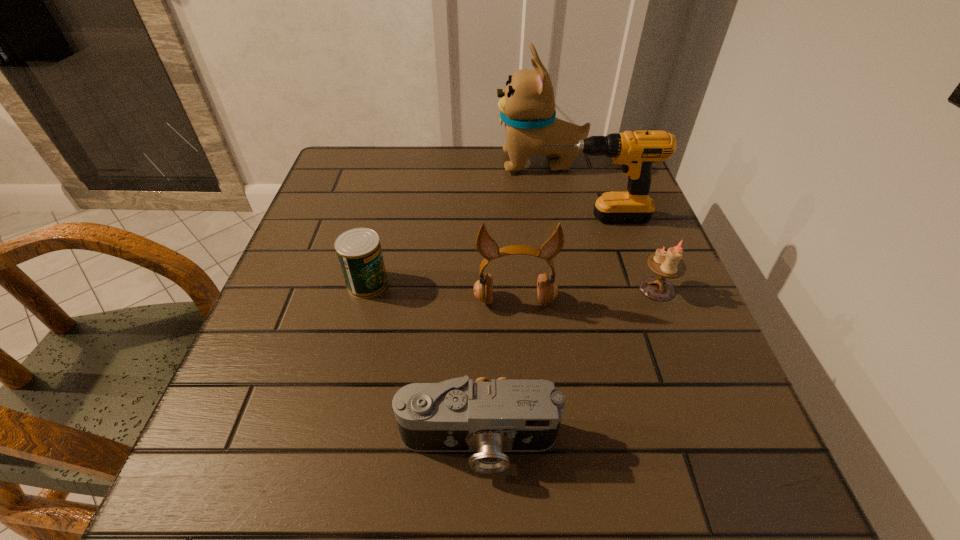
Where is `vacant space that is in between the earphone and the nearest object`? vacant space that is in between the earphone and the nearest object is located at coordinates (496, 372).

You are a GUI agent. You are given a task and a screenshot of the screen. Output one action in this format:
    pyautogui.click(x=<x>, y=<y>)
    Task: Click on the free space that is in between the earphone and the can
    The height and width of the screenshot is (540, 960).
    Given the screenshot: What is the action you would take?
    pyautogui.click(x=441, y=292)

Locate an element on the screen. Image resolution: width=960 pixels, height=540 pixels. free spot between the earphone and the farthest object is located at coordinates (527, 232).

The height and width of the screenshot is (540, 960). In order to click on empty space between the earphone and the candle holder in this screenshot , I will do `click(586, 295)`.

This screenshot has width=960, height=540. In order to click on vacant space that's between the fourth tallest object and the can in this screenshot , I will do 513,286.

Locate an element on the screen. This screenshot has width=960, height=540. vacant region between the leftmost object and the nearest object is located at coordinates point(423,363).

This screenshot has height=540, width=960. Find the location of `empty space that is in between the earphone and the farthest object`. empty space that is in between the earphone and the farthest object is located at coordinates (527, 232).

At what (x,y) coordinates should I click in order to perform the action: click on vacant space that's between the camera and the leftmost object. Please return your answer as a coordinate pair (x, y). Image resolution: width=960 pixels, height=540 pixels. Looking at the image, I should click on (423, 363).

Where is `object that is the fourth closest to the puppy`? This screenshot has height=540, width=960. object that is the fourth closest to the puppy is located at coordinates point(359,252).

Locate an element on the screen. Image resolution: width=960 pixels, height=540 pixels. object that is the fifth closest one to the earphone is located at coordinates (527, 106).